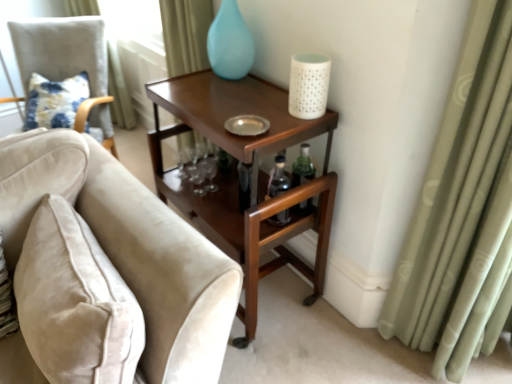
Where is `free space to the left of matte blue glass vase at upper center`? The width and height of the screenshot is (512, 384). free space to the left of matte blue glass vase at upper center is located at coordinates (196, 80).